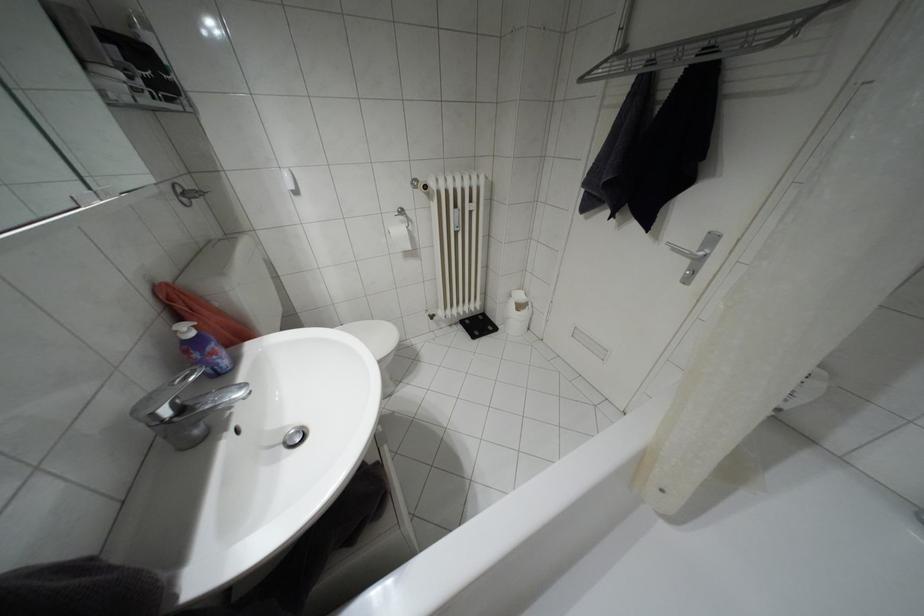
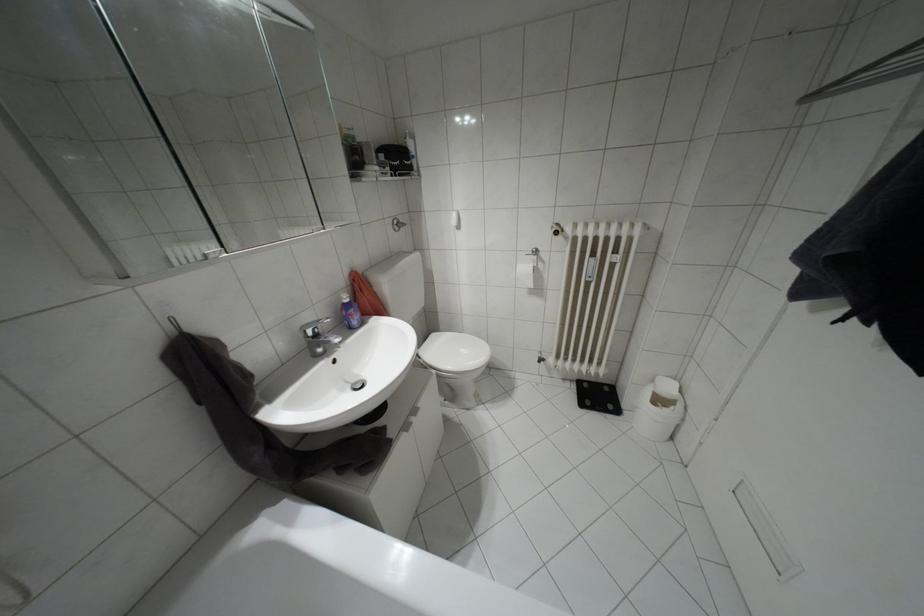
The point at (407, 246) is marked in the first image. Where is the corresponding point in the second image?

(530, 284)